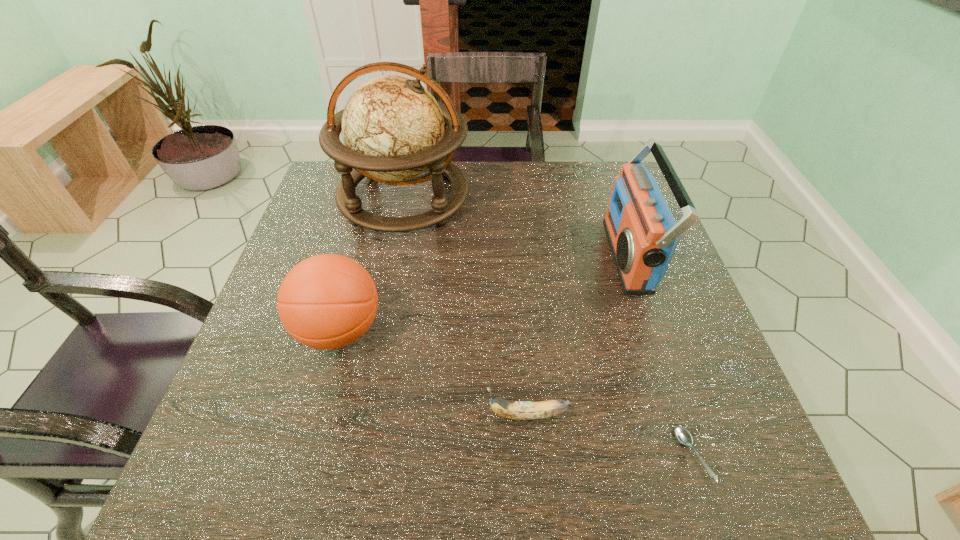
Find the location of a particular element. This screenshot has height=540, width=960. vacant space in between the radio receiver and the third tallest object is located at coordinates (484, 293).

Identify the location of vacant point located between the globe and the shortest object. (548, 326).

At what (x,y) coordinates should I click in order to perform the action: click on free space between the tallest object and the basketball. Please return your answer as a coordinate pair (x, y). Looking at the image, I should click on (372, 264).

What are the coordinates of `empty space between the fourth farthest object and the globe` in the screenshot? It's located at coord(466,306).

Find the location of a particular element. Image resolution: width=960 pixels, height=540 pixels. empty space that is in between the fourth farthest object and the radio receiver is located at coordinates (578, 335).

Where is `free spot between the third shortest object and the shortest object`? This screenshot has height=540, width=960. free spot between the third shortest object and the shortest object is located at coordinates (516, 393).

This screenshot has width=960, height=540. Identify the location of vacant region between the fourth shortest object and the third shortest object. (484, 293).

You are a GUI agent. You are given a task and a screenshot of the screen. Output one action in this format:
    pyautogui.click(x=<x>, y=<y>)
    Task: Click on the free space between the globe and the fourth shortest object
    Image resolution: width=960 pixels, height=540 pixels.
    Given the screenshot: What is the action you would take?
    pyautogui.click(x=516, y=226)

At what (x,y) coordinates should I click in order to perform the action: click on free area in between the third tallest object and the second nearest object. Please return your answer as a coordinate pair (x, y). Looking at the image, I should click on (434, 373).

Locate an element on the screen. This screenshot has height=540, width=960. free space that is in between the globe and the soupspoon is located at coordinates (548, 326).